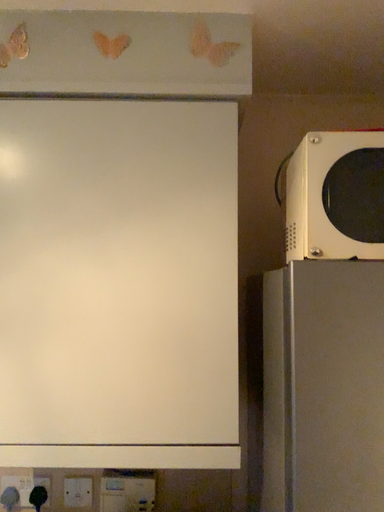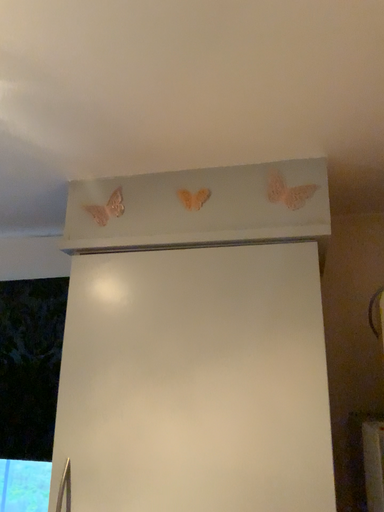
Question: Which way did the camera rotate in the video?

Choices:
 (A) rotated upward
 (B) rotated downward

Answer: (A)